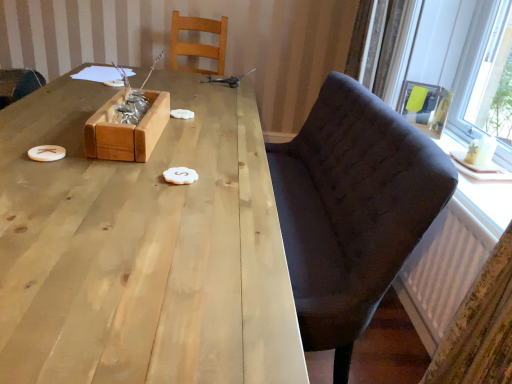
The width and height of the screenshot is (512, 384). I want to click on free location to the right of white matte cookie at center, the first food in the right-to-left sequence, so click(x=229, y=188).